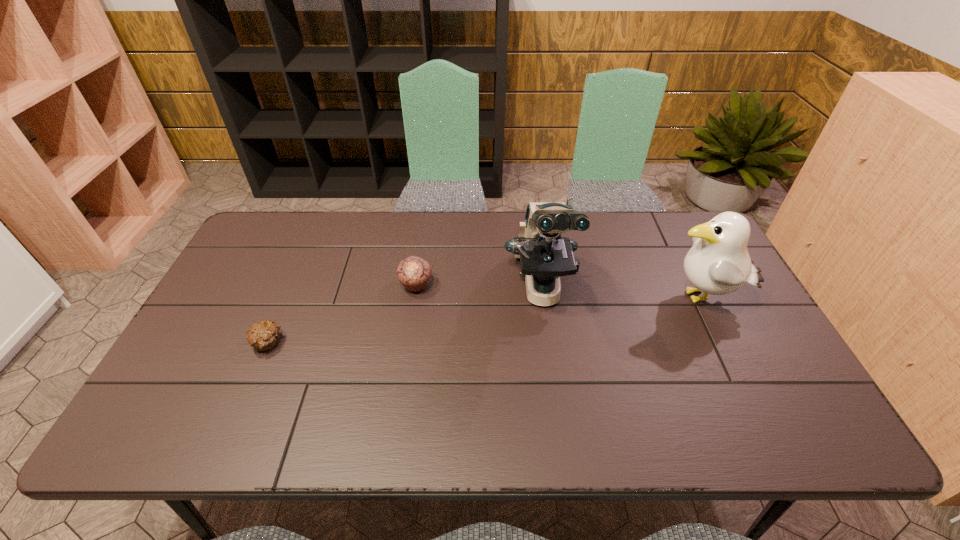
Find the location of a particular element. free space between the microscope and the shorter muffin is located at coordinates (404, 316).

Find the location of a particular element. This screenshot has width=960, height=540. empty location between the second tallest object and the tallest object is located at coordinates (621, 294).

Locate an element on the screen. vacant area between the tallest object and the shorter muffin is located at coordinates (404, 316).

Locate an element on the screen. The height and width of the screenshot is (540, 960). vacant space in between the leftmost object and the third object from right to left is located at coordinates (342, 314).

Locate an element on the screen. free space between the shortest object and the tallest object is located at coordinates (404, 316).

At what (x,y) coordinates should I click in order to perform the action: click on free area in between the shorter muffin and the farther muffin. Please return your answer as a coordinate pair (x, y). Looking at the image, I should click on click(342, 314).

This screenshot has height=540, width=960. Identify the location of free point between the second shortest object and the shortest object. (342, 314).

This screenshot has height=540, width=960. I want to click on vacant space that is in between the microscope and the leftmost object, so click(x=404, y=316).

Where is `empty space between the third tallest object and the third object from left to right`? empty space between the third tallest object and the third object from left to right is located at coordinates (479, 287).

Locate which object is the third closest to the right muffin. Please provide its 2D coordinates. Your answer should be formatted as a tuple, i.e. [(x, y)], where the tuple contains the x and y coordinates of a point satisfying the conditions above.

[(718, 263)]